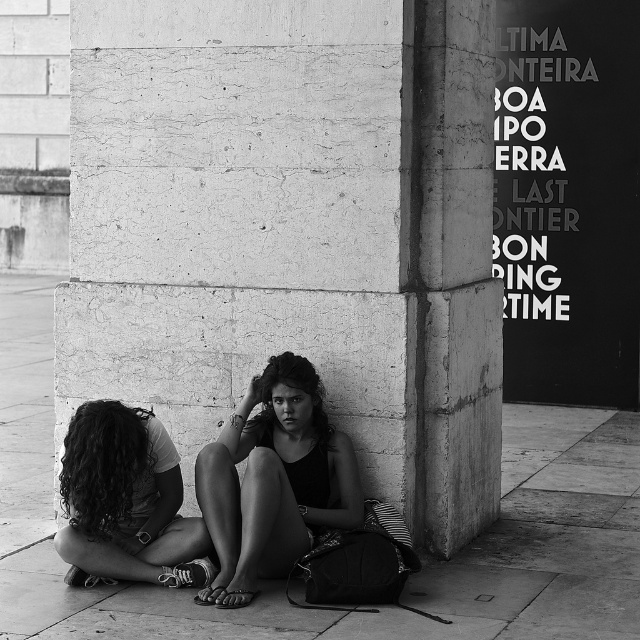
Question: Does smooth concrete pavement at lower center appear on the left side of smooth black tank top at center?

Choices:
 (A) yes
 (B) no

Answer: (A)

Question: Can you confirm if smooth black tank top at center is positioned to the left of curly hair at lower left?

Choices:
 (A) no
 (B) yes

Answer: (A)

Question: Which point is closer to the camera?

Choices:
 (A) curly hair at lower left
 (B) smooth concrete pavement at lower center

Answer: (B)

Question: Which is farther from the curly hair at lower left?

Choices:
 (A) smooth concrete pavement at lower center
 (B) smooth concrete pillar at center

Answer: (B)

Question: Which of the following is the closest to the observer?

Choices:
 (A) (211, 189)
 (B) (109, 616)
 (C) (288, 504)

Answer: (B)

Question: Does smooth concrete pavement at lower center appear on the right side of smooth black tank top at center?

Choices:
 (A) no
 (B) yes

Answer: (A)